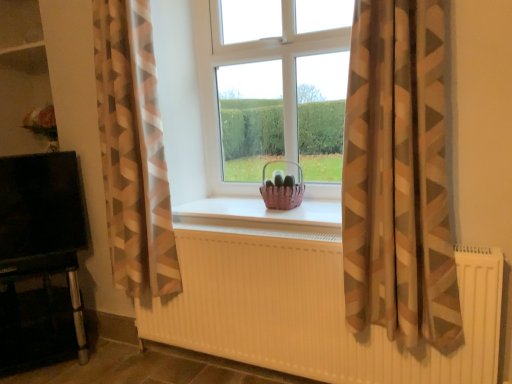
Question: Is the depth of brown sheer curtain at center, which is the 2th curtain in left-to-right order, greater than that of pink woven basket at center?

Choices:
 (A) yes
 (B) no

Answer: (B)

Question: Does brown sheer curtain at center, which is the 2th curtain in left-to-right order, contain pink woven basket at center?

Choices:
 (A) no
 (B) yes

Answer: (A)

Question: Is brown sheer curtain at center, which is the 2th curtain in left-to-right order, in front of pink woven basket at center?

Choices:
 (A) yes
 (B) no

Answer: (A)

Question: Is brown sheer curtain at center, which is the 2th curtain in left-to-right order, facing towards pink woven basket at center?

Choices:
 (A) yes
 (B) no

Answer: (B)

Question: Does brown sheer curtain at center, which is the 2th curtain in left-to-right order, have a greater height compared to pink woven basket at center?

Choices:
 (A) no
 (B) yes

Answer: (B)

Question: Is white ribbed radiator at center in front of or behind brown sheer curtain at center, positioned as the first curtain in right-to-left order, in the image?

Choices:
 (A) behind
 (B) front

Answer: (A)

Question: Considering the positions of white ribbed radiator at center and brown sheer curtain at center, which is the 2th curtain in left-to-right order, in the image, is white ribbed radiator at center wider or thinner than brown sheer curtain at center, which is the 2th curtain in left-to-right order,?

Choices:
 (A) wide
 (B) thin

Answer: (B)

Question: Is white ribbed radiator at center bigger or smaller than brown sheer curtain at center, which is the 2th curtain in left-to-right order?

Choices:
 (A) big
 (B) small

Answer: (B)

Question: Based on their positions, is white ribbed radiator at center located to the left or right of brown sheer curtain at center, which is the 2th curtain in left-to-right order?

Choices:
 (A) right
 (B) left

Answer: (B)

Question: In terms of width, does brown sheer curtain at center, positioned as the first curtain in right-to-left order, look wider or thinner when compared to black glossy tv at left?

Choices:
 (A) wide
 (B) thin

Answer: (A)

Question: Considering the positions of brown sheer curtain at center, positioned as the first curtain in right-to-left order, and black glossy tv at left in the image, is brown sheer curtain at center, positioned as the first curtain in right-to-left order, bigger or smaller than black glossy tv at left?

Choices:
 (A) small
 (B) big

Answer: (B)

Question: Is brown sheer curtain at center, which is the 2th curtain in left-to-right order, inside or outside of black glossy tv at left?

Choices:
 (A) outside
 (B) inside

Answer: (A)

Question: Considering their positions, is brown sheer curtain at center, positioned as the first curtain in right-to-left order, located in front of or behind black glossy tv at left?

Choices:
 (A) front
 (B) behind

Answer: (A)

Question: From a real-world perspective, is brown sheer curtain at center, positioned as the first curtain in right-to-left order, above or below pink woven basket at center?

Choices:
 (A) below
 (B) above

Answer: (B)

Question: Does point (443, 253) appear closer or farther from the camera than point (279, 187)?

Choices:
 (A) closer
 (B) farther

Answer: (A)